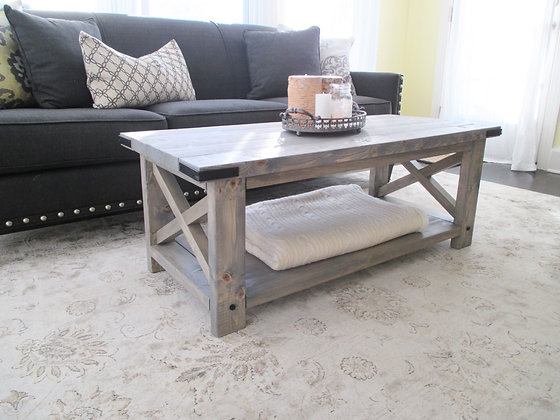
The height and width of the screenshot is (420, 560). What are the coordinates of `table shelf` in the screenshot? It's located at (360, 262).